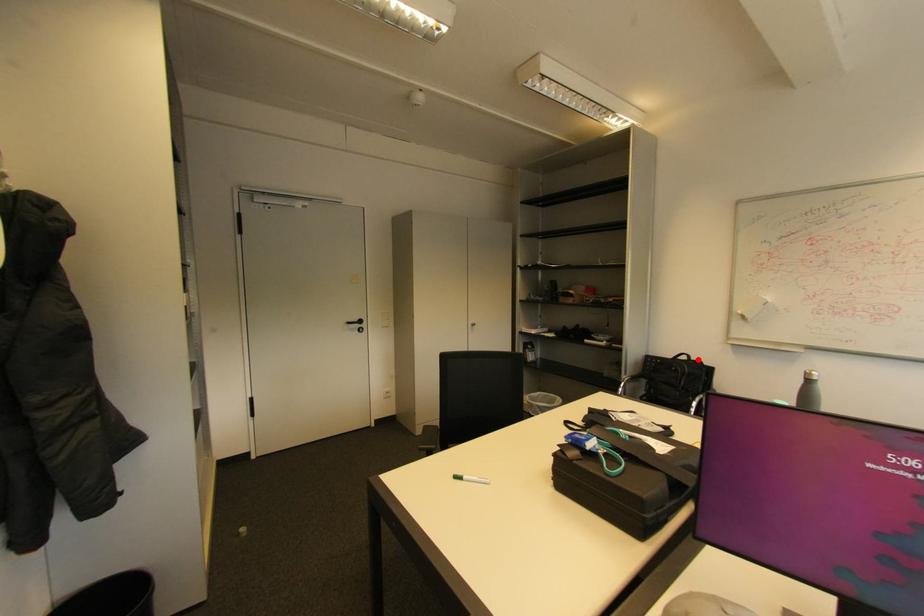
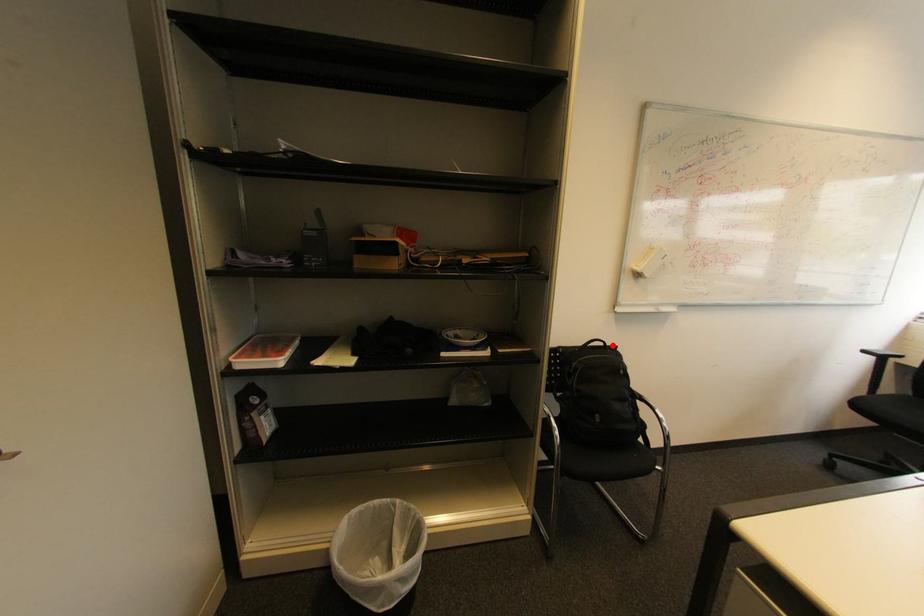
I am providing you with two images of the same scene from different viewpoints. A red point is marked on the first image and another point is marked on the second image. Do the highlighted points in image1 and image2 indicate the same real-world spot?

Yes